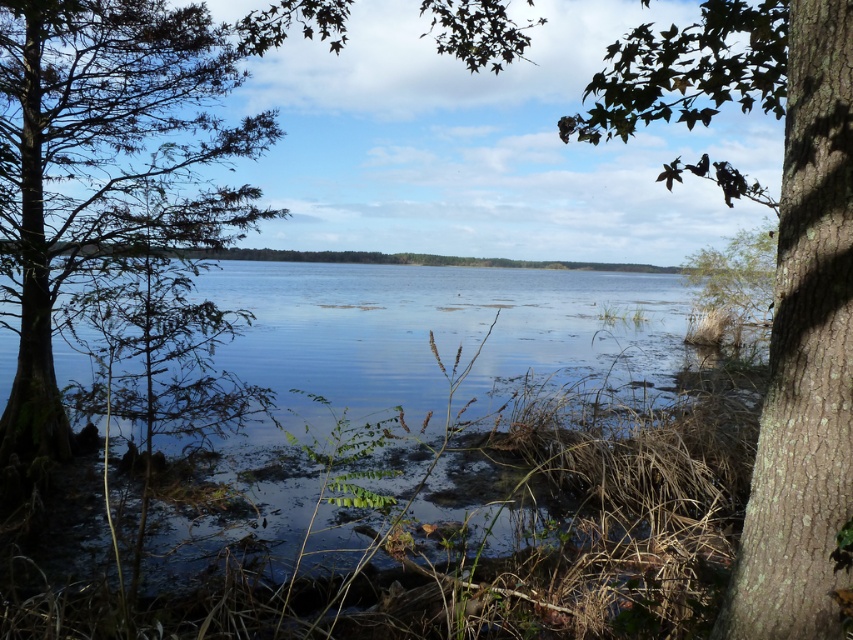
You are standing at the edge of the lakeside scene and see the clear water at center and the brown rough bark tree at right. Which object is positioned to the left of the other?

The clear water at center is to the left of the brown rough bark tree at right.

You are a painter setting up your easel to capture the lakeside scene. You want to ensure that the clear water at center and the brown rough bark tree at right are both visible in your painting. Given their sizes, which object should you place closer to the center of your canvas to maintain balance?

The clear water at center is smaller than the brown rough bark tree at right, so to balance the composition, you should place the larger brown rough bark tree at right closer to the center of the canvas while positioning the smaller clear water at center slightly off to the side.